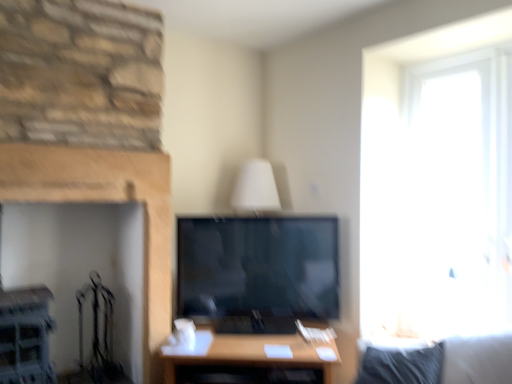
Question: Choose the correct answer: Is wooden table at center inside smooth stone fireplace at left or outside it?

Choices:
 (A) outside
 (B) inside

Answer: (A)

Question: From a real-world perspective, is wooden table at center physically located above or below smooth stone fireplace at left?

Choices:
 (A) above
 (B) below

Answer: (B)

Question: Considering the positions of point (311, 370) and point (152, 261), is point (311, 370) closer or farther from the camera than point (152, 261)?

Choices:
 (A) farther
 (B) closer

Answer: (B)

Question: In terms of width, does smooth stone fireplace at left look wider or thinner when compared to wooden table at center?

Choices:
 (A) wide
 (B) thin

Answer: (B)

Question: Considering the positions of point [x=69, y=173] and point [x=311, y=370], is point [x=69, y=173] closer or farther from the camera than point [x=311, y=370]?

Choices:
 (A) farther
 (B) closer

Answer: (A)

Question: From the image's perspective, is smooth stone fireplace at left above or below wooden table at center?

Choices:
 (A) above
 (B) below

Answer: (A)

Question: In terms of size, does smooth stone fireplace at left appear bigger or smaller than wooden table at center?

Choices:
 (A) small
 (B) big

Answer: (A)